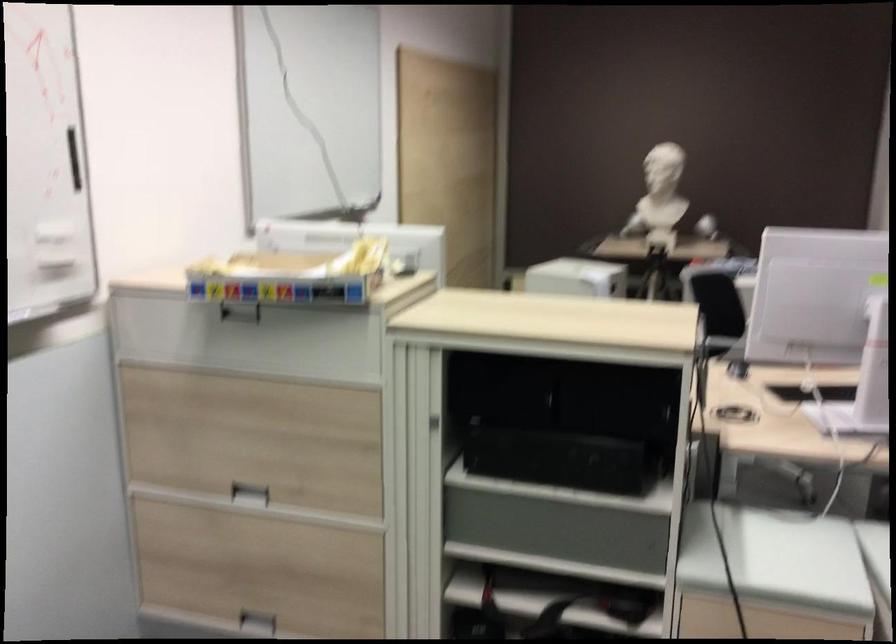
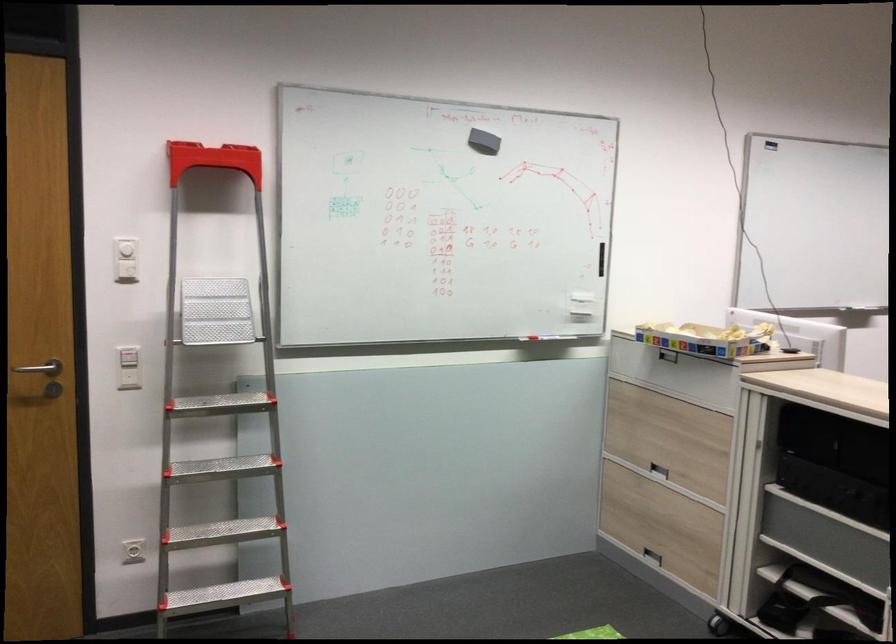
In the second image, find the point that corresponds to point 323,288 in the first image.

(705, 339)